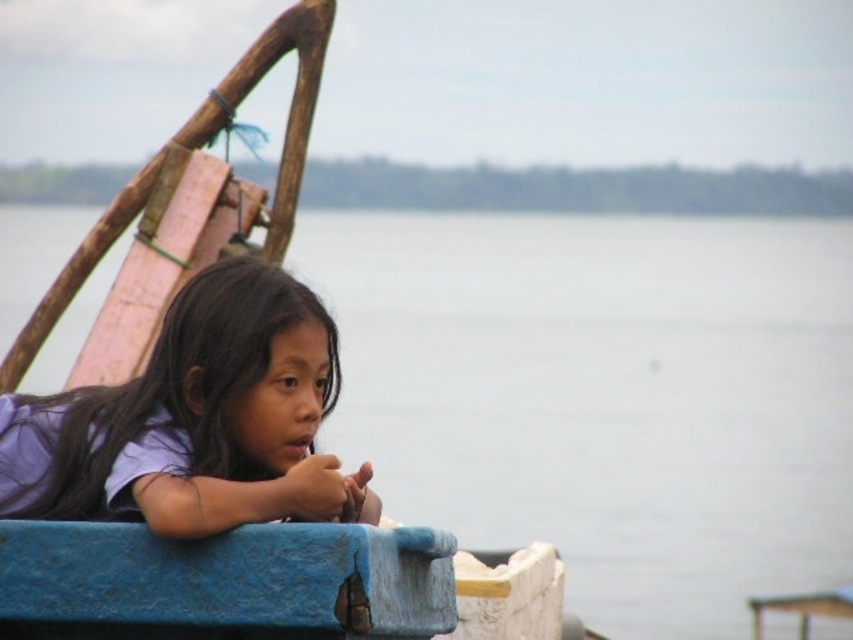
How distant is gray water at center from purple matte shirt at center?

gray water at center and purple matte shirt at center are 32.98 meters apart from each other.

Is point (811, 444) closer to viewer compared to point (293, 412)?

No, it is behind (293, 412).

Find the location of a particular element. This screenshot has height=640, width=853. gray water at center is located at coordinates (604, 396).

Find the location of a particular element. This screenshot has width=853, height=640. gray water at center is located at coordinates (604, 396).